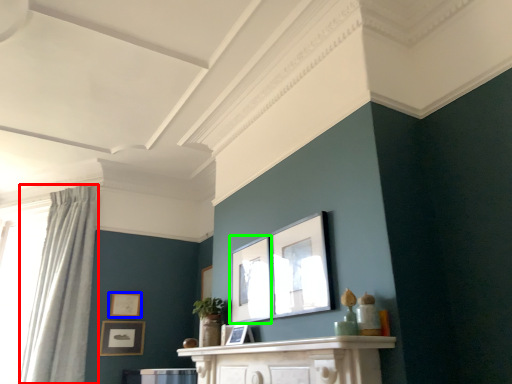
Question: Which object is the farthest from curtain (highlighted by a red box)? Choose among these: picture frame (highlighted by a blue box) or picture frame (highlighted by a green box).

Choices:
 (A) picture frame
 (B) picture frame

Answer: (B)